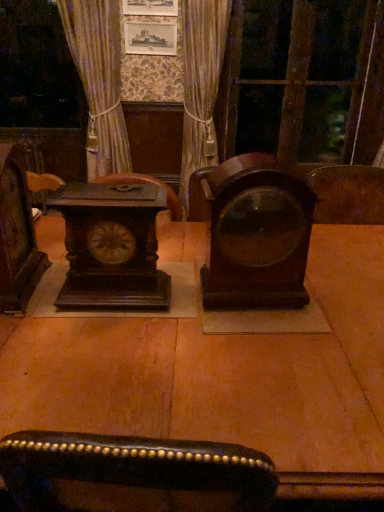
Locate an element on the screen. The image size is (384, 512). vacant space to the left of mahogany wood alarm clock at center, the 2th alarm clock positioned from the left is located at coordinates (181, 296).